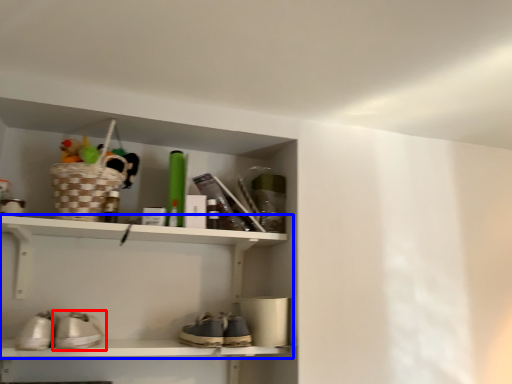
Question: Which object is closer to the camera taking this photo, footwear (highlighted by a red box) or shelf (highlighted by a blue box)?

Choices:
 (A) footwear
 (B) shelf

Answer: (A)